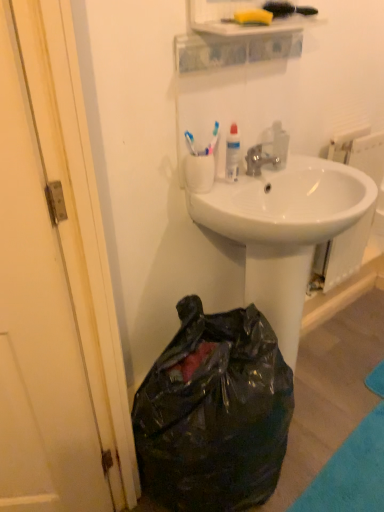
Question: Does black plastic bag at lower left appear on the right side of white plastic cup at upper center?

Choices:
 (A) no
 (B) yes

Answer: (B)

Question: Does black plastic bag at lower left contain white plastic cup at upper center?

Choices:
 (A) yes
 (B) no

Answer: (B)

Question: Is black plastic bag at lower left completely or partially outside of white plastic cup at upper center?

Choices:
 (A) yes
 (B) no

Answer: (A)

Question: From the image's perspective, is black plastic bag at lower left on top of white plastic cup at upper center?

Choices:
 (A) no
 (B) yes

Answer: (A)

Question: From a real-world perspective, is black plastic bag at lower left under white plastic cup at upper center?

Choices:
 (A) no
 (B) yes

Answer: (B)

Question: In terms of height, does white glossy sink at center look taller or shorter compared to black plastic bag at lower left?

Choices:
 (A) tall
 (B) short

Answer: (A)

Question: Considering the positions of white glossy sink at center and black plastic bag at lower left in the image, is white glossy sink at center wider or thinner than black plastic bag at lower left?

Choices:
 (A) thin
 (B) wide

Answer: (B)

Question: Is white glossy sink at center to the left or to the right of black plastic bag at lower left in the image?

Choices:
 (A) left
 (B) right

Answer: (B)

Question: Considering their positions, is white glossy sink at center located in front of or behind black plastic bag at lower left?

Choices:
 (A) front
 (B) behind

Answer: (B)

Question: Is white glossy radiator at upper right to the left or to the right of black plastic bag at lower left in the image?

Choices:
 (A) right
 (B) left

Answer: (A)

Question: Do you think white glossy radiator at upper right is within black plastic bag at lower left, or outside of it?

Choices:
 (A) inside
 (B) outside

Answer: (B)

Question: From a real-world perspective, is white glossy radiator at upper right physically located above or below black plastic bag at lower left?

Choices:
 (A) above
 (B) below

Answer: (A)

Question: Looking at the image, does white glossy radiator at upper right seem bigger or smaller compared to black plastic bag at lower left?

Choices:
 (A) big
 (B) small

Answer: (B)

Question: In terms of height, does white glossy sink at center look taller or shorter compared to silver metallic faucet at center?

Choices:
 (A) short
 (B) tall

Answer: (B)

Question: Would you say white glossy sink at center is inside or outside silver metallic faucet at center?

Choices:
 (A) outside
 (B) inside

Answer: (A)